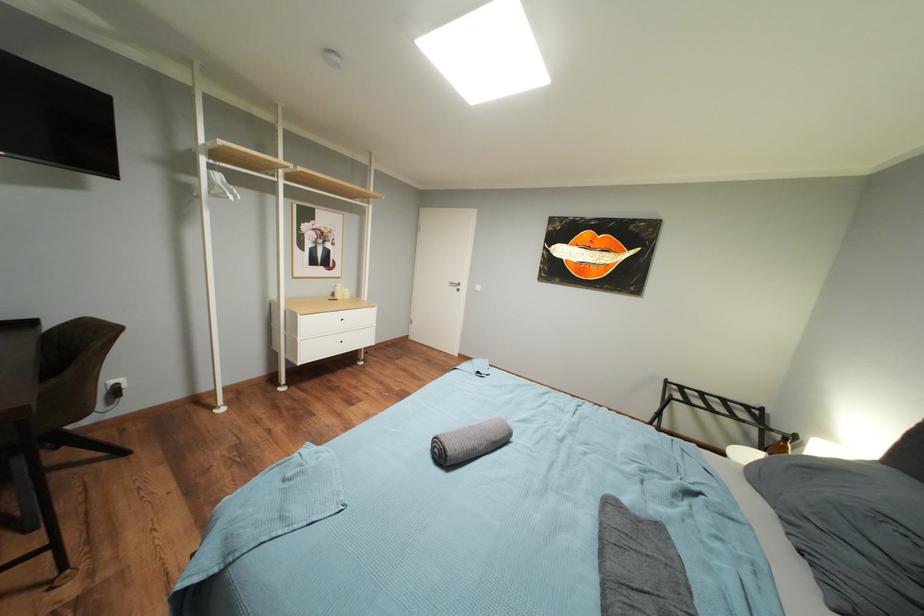
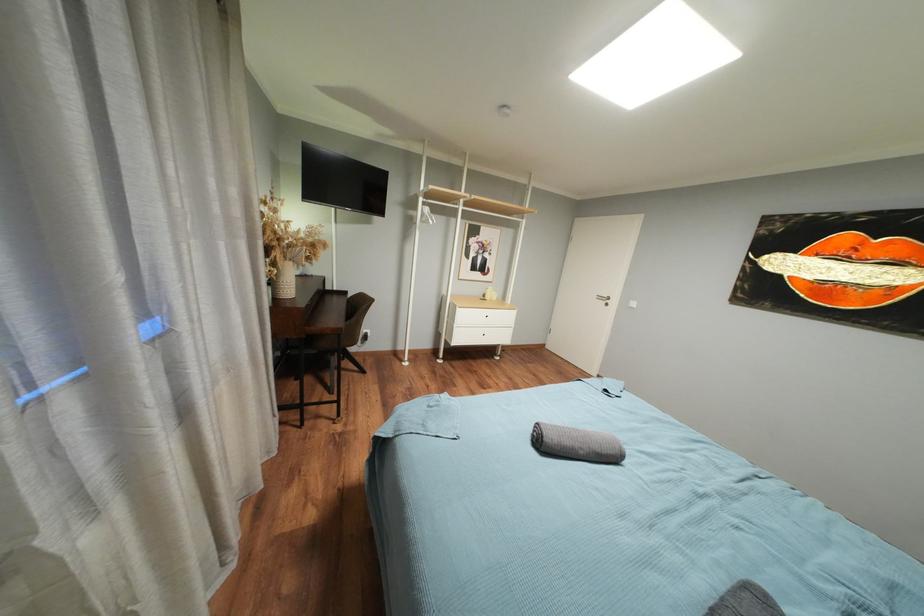
Question: The first image is from the beginning of the video and the second image is from the end. How did the camera likely rotate when shooting the video?

Choices:
 (A) Left
 (B) Right
 (C) Up
 (D) Down

Answer: (A)